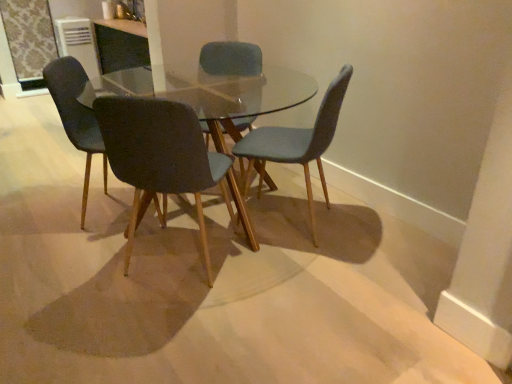
Question: From a real-world perspective, is matte black chair at left, arranged as the first chair when viewed from the left, physically located above or below matte black chair at center, marked as the 3th chair in a right-to-left arrangement?

Choices:
 (A) above
 (B) below

Answer: (A)

Question: Is point (90, 125) closer or farther from the camera than point (207, 281)?

Choices:
 (A) farther
 (B) closer

Answer: (A)

Question: Which of these objects is positioned closest to the matte blue chair at center, the fourth chair from the left?

Choices:
 (A) matte black chair at center, which is the 2th chair in left-to-right order
 (B) clear glass table at center
 (C) matte black chair at left, arranged as the first chair when viewed from the left
 (D) matte blue chair at center, which is the second chair in right-to-left order

Answer: (B)

Question: Considering the real-world distances, which object is closest to the clear glass table at center?

Choices:
 (A) matte blue chair at center, the fourth chair from the left
 (B) matte black chair at left, the 4th chair positioned from the right
 (C) matte black chair at center, marked as the 3th chair in a right-to-left arrangement
 (D) matte blue chair at center, which is counted as the 3th chair, starting from the left

Answer: (A)